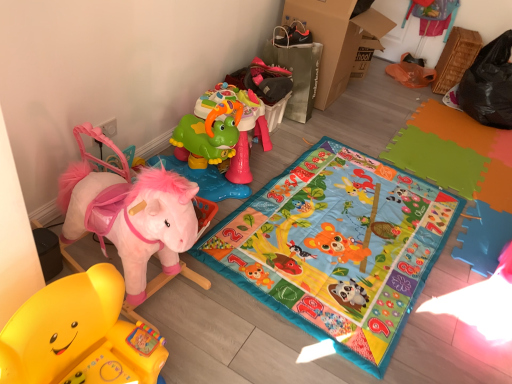
Question: Is plush pink horse at left, marked as the 2th toy in a back-to-front arrangement, situated inside green plastic toy at upper center, the third toy positioned from the front, or outside?

Choices:
 (A) outside
 (B) inside

Answer: (A)

Question: Is plush pink horse at left, marked as the 2th toy in a back-to-front arrangement, wider or thinner than green plastic toy at upper center, which is counted as the 1th toy, starting from the back?

Choices:
 (A) thin
 (B) wide

Answer: (B)

Question: Which object is the farthest from the cardboard at upper right?

Choices:
 (A) rubber yellow rocking horse at lower left, which is the 3th toy in back-to-front order
 (B) green plastic toy at upper center, which is counted as the 1th toy, starting from the back
 (C) plush pink horse at left, which is the second toy in front-to-back order
 (D) multicolored fabric play mat at center

Answer: (A)

Question: Which object is the farthest from the cardboard at upper right?

Choices:
 (A) multicolored fabric play mat at center
 (B) green plastic toy at upper center, the third toy positioned from the front
 (C) plush pink horse at left, which is the second toy in front-to-back order
 (D) rubber yellow rocking horse at lower left, which is the 3th toy in back-to-front order

Answer: (D)